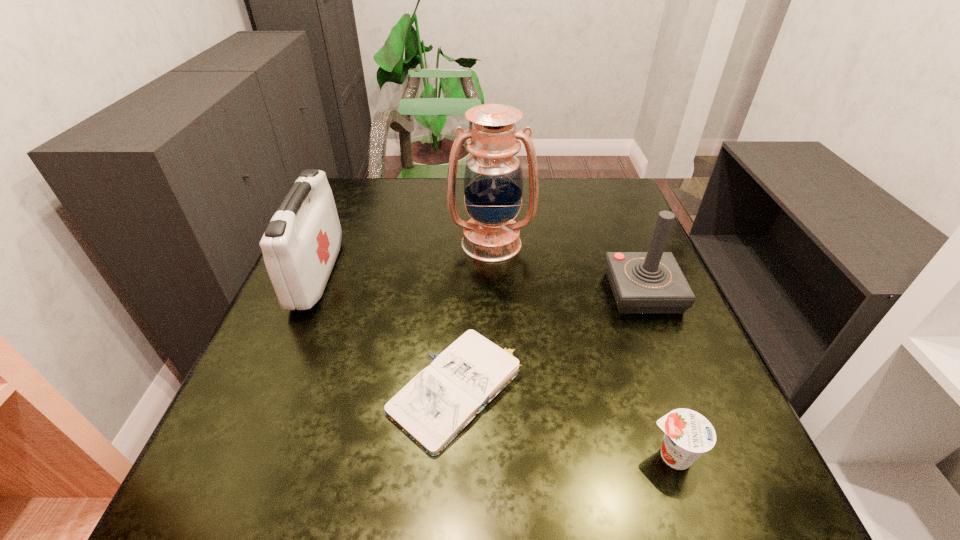
In order to click on oil lamp in this screenshot , I will do `click(493, 179)`.

Locate an element on the screen. This screenshot has width=960, height=540. the first-aid kit is located at coordinates (301, 243).

This screenshot has height=540, width=960. I want to click on joystick, so click(652, 282).

I want to click on yogurt, so click(x=688, y=434).

I want to click on notebook, so click(434, 407).

Identify the location of free space located on the left of the oil lamp. The height and width of the screenshot is (540, 960). (360, 244).

I want to click on vacant space situated 0.130m on the front side of the leftmost object, so click(387, 274).

You are a GUI agent. You are given a task and a screenshot of the screen. Output one action in this format:
    pyautogui.click(x=<x>, y=<y>)
    Task: Click on the free space located 0.270m on the rectangular base of the joystick
    This screenshot has height=540, width=960.
    Given the screenshot: What is the action you would take?
    pyautogui.click(x=700, y=433)

Locate an element on the screen. vacant space situated on the left of the yogurt is located at coordinates (466, 456).

Find the location of a particular element. vacant area located on the right of the shortest object is located at coordinates (640, 390).